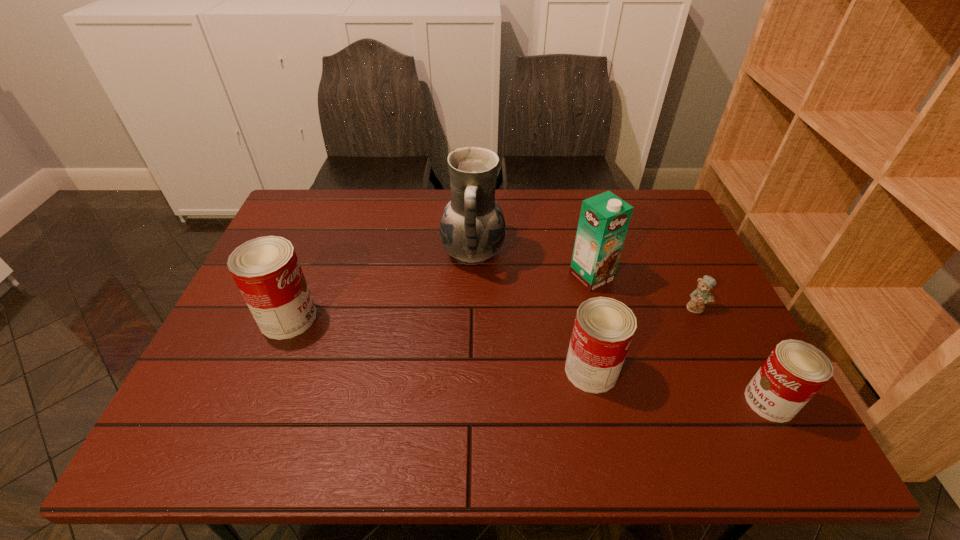
Where is `free space between the shortest object and the second shortest object`? free space between the shortest object and the second shortest object is located at coordinates (733, 355).

Identify the location of empty space between the second tallest object and the pitcher. This screenshot has height=540, width=960. (x=532, y=265).

The height and width of the screenshot is (540, 960). What are the coordinates of `free space that is in between the shortest can and the second shortest can` in the screenshot? It's located at (681, 386).

Find the location of a particular element. Image resolution: width=960 pixels, height=540 pixels. vacant space in between the second tallest object and the farthest can is located at coordinates (440, 298).

This screenshot has height=540, width=960. Identify the location of free point between the leftmost can and the rightmost can. (529, 360).

The height and width of the screenshot is (540, 960). In order to click on free space between the teddy bear and the fifth shortest object in this screenshot , I will do click(643, 292).

Identify the location of free space between the farthest can and the shortest object. (492, 313).

This screenshot has height=540, width=960. In order to click on vacant area that lies between the fifth shortest object and the shortest object in this screenshot , I will do `click(643, 292)`.

I want to click on vacant area that lies between the leftmost object and the carton, so click(x=440, y=298).

Identify which object is the fifth nearest to the farthest can. Please provide its 2D coordinates. Your answer should be formatted as a tuple, i.e. [(x, y)], where the tuple contains the x and y coordinates of a point satisfying the conditions above.

[(795, 371)]